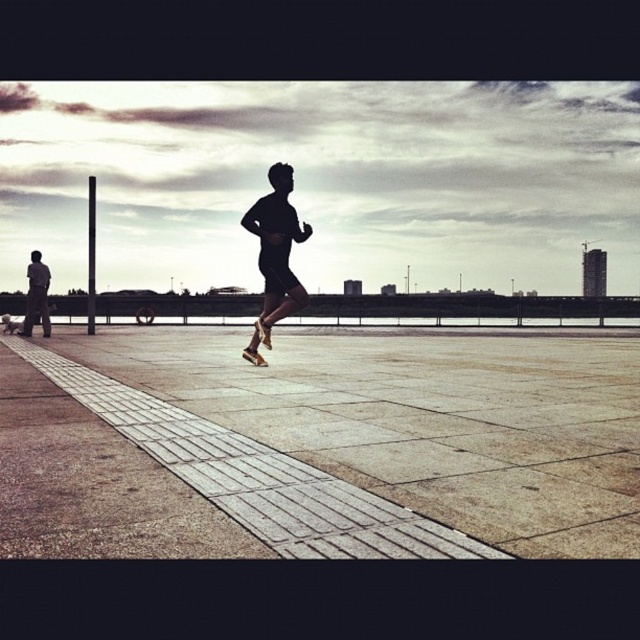
Question: Estimate the real-world distances between objects in this image. Which object is closer to the gray concrete pavement at center?

Choices:
 (A) black matte running shoes at center
 (B) dark gray pants at left

Answer: (A)

Question: Is black matte running shoes at center wider than dark gray pants at left?

Choices:
 (A) no
 (B) yes

Answer: (B)

Question: Among these objects, which one is farthest from the camera?

Choices:
 (A) gray concrete pavement at center
 (B) black matte running shoes at center

Answer: (B)

Question: Does gray concrete pavement at center have a greater width compared to black matte running shoes at center?

Choices:
 (A) yes
 (B) no

Answer: (A)

Question: Is gray concrete pavement at center to the left of black matte running shoes at center from the viewer's perspective?

Choices:
 (A) no
 (B) yes

Answer: (A)

Question: Which object is farther from the camera taking this photo?

Choices:
 (A) gray concrete pavement at center
 (B) black matte running shoes at center
 (C) dark gray pants at left

Answer: (C)